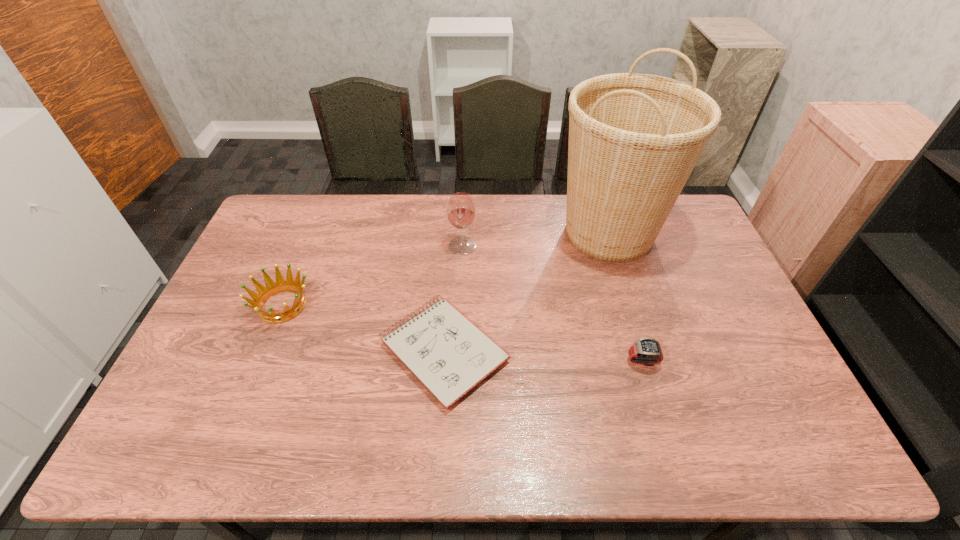
Locate an element on the screen. The image size is (960, 540). vacant point located between the tallest object and the second shortest object is located at coordinates (626, 296).

Locate an element on the screen. free area in between the leftmost object and the tallest object is located at coordinates (445, 269).

Locate an element on the screen. This screenshot has height=540, width=960. free space between the second tallest object and the notepad is located at coordinates point(453,298).

Locate an element on the screen. Image resolution: width=960 pixels, height=540 pixels. free point between the wineglass and the shortest object is located at coordinates (453, 298).

What are the coordinates of `vacant area between the wineglass and the watch` in the screenshot? It's located at (552, 303).

At what (x,y) coordinates should I click in order to perform the action: click on empty location between the watch and the tallest object. Please return your answer as a coordinate pair (x, y). This screenshot has height=540, width=960. Looking at the image, I should click on (626, 296).

Identify the location of free area in between the notepad and the second tallest object. click(453, 298).

This screenshot has height=540, width=960. In order to click on free space that is in between the crown and the second tallest object in this screenshot , I will do `click(372, 275)`.

In order to click on free space between the tallest object and the wineglass in this screenshot , I will do `click(536, 239)`.

At what (x,y) coordinates should I click in order to perform the action: click on free point between the second shortest object and the basket. Please return your answer as a coordinate pair (x, y). Looking at the image, I should click on (626, 296).